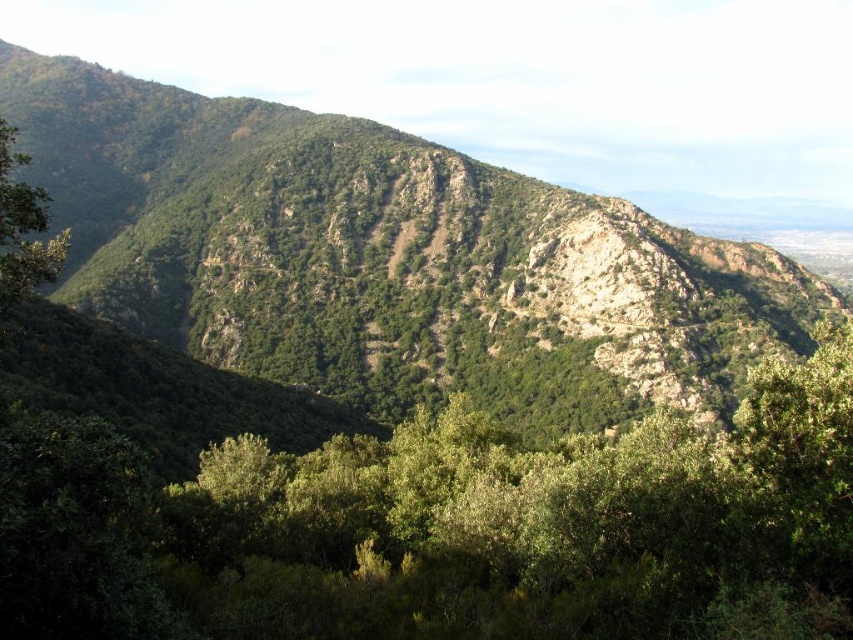
Is green rocky mountain at center above green leafy tree at left?

Yes, green rocky mountain at center is above green leafy tree at left.

Is point (799, 332) less distant than point (45, 253)?

No.

This screenshot has height=640, width=853. What do you see at coordinates (387, 259) in the screenshot?
I see `green rocky mountain at center` at bounding box center [387, 259].

Where is `green rocky mountain at center`? The width and height of the screenshot is (853, 640). green rocky mountain at center is located at coordinates (387, 259).

How far apart are green leafy tree at center and green leafy tree at left?

The distance of green leafy tree at center from green leafy tree at left is 29.24 meters.

Who is more distant from viewer, [282,456] or [22,204]?

Point [282,456]

This screenshot has width=853, height=640. Identify the location of green leafy tree at center. (445, 529).

Locate an element on the screen. The image size is (853, 640). green leafy tree at center is located at coordinates (445, 529).

Is point (393, 536) in front of point (654, 244)?

That is True.

Is green leafy tree at center to the right of green rocky mountain at center from the viewer's perspective?

Indeed, green leafy tree at center is positioned on the right side of green rocky mountain at center.

Image resolution: width=853 pixels, height=640 pixels. I want to click on green leafy tree at center, so click(445, 529).

Find the location of a particular element. The image size is (853, 640). green leafy tree at center is located at coordinates tap(445, 529).